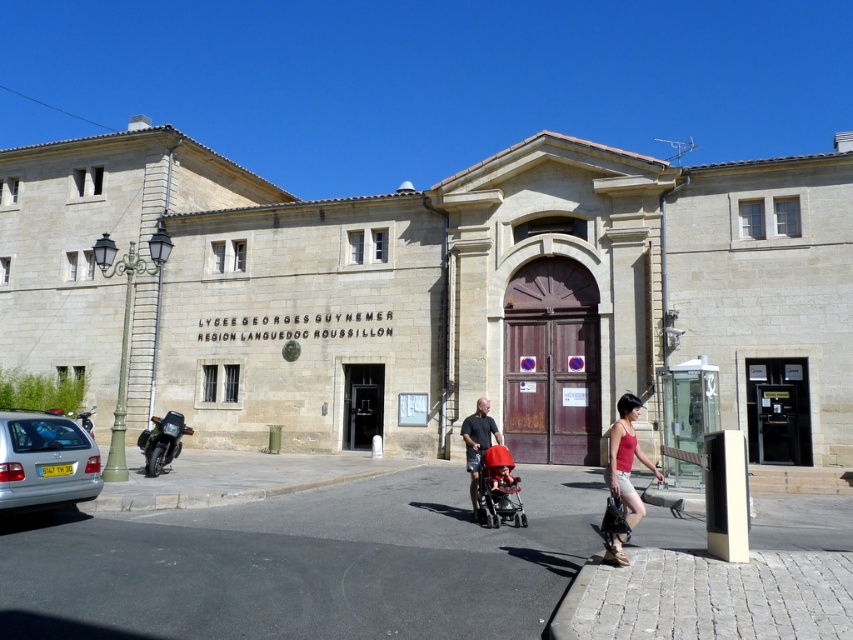
Question: Which point is farther from the camera taking this photo?

Choices:
 (A) (503, 477)
 (B) (137, 445)
 (C) (625, 419)
 (D) (27, 436)

Answer: (B)

Question: Which object appears closest to the camera in this image?

Choices:
 (A) matte black shirt at center
 (B) red plastic baby carriage at center
 (C) shiny black motorcycle at lower left
 (D) matte red tank top at center

Answer: (D)

Question: Is brick pavement at center smaller than matte black shirt at center?

Choices:
 (A) no
 (B) yes

Answer: (A)

Question: In this image, where is brick pavement at center located relative to matte red tank top at center?

Choices:
 (A) above
 (B) below

Answer: (B)

Question: Which object is positioned farthest from the shiny black motorcycle at lower left?

Choices:
 (A) red plastic baby carriage at center
 (B) silver metallic car at lower left

Answer: (A)

Question: Can you confirm if brick pavement at center is positioned to the right of silver metallic car at lower left?

Choices:
 (A) no
 (B) yes

Answer: (B)